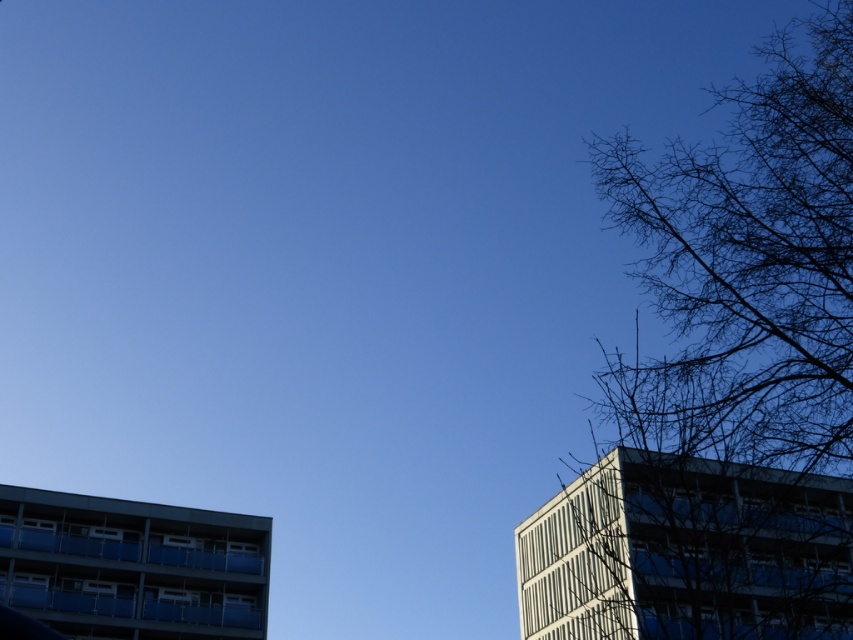
In the scene shown: You are standing in a park and see the bare branches at right in the distance. If you want to take a photo of them, will you need to zoom in your camera to capture them clearly?

The bare branches at right are 11.54 meters away from the viewer. Since they are relatively far away, you would need to zoom in your camera to capture them clearly.

You are a bird looking for a place to perch. You see the bare branches at right and the white glass building at right. Which one is bigger and would provide a better spot to land?

The bare branches at right has a larger size compared to the white glass building at right, so it would provide a better spot to land.

You are standing in the middle of the image and want to look at the white glass building at right and the blue glass balcony at lower left. Which one do you need to look upwards to see?

The white glass building at right is above the blue glass balcony at lower left, so you need to look upwards to see the white glass building at right.